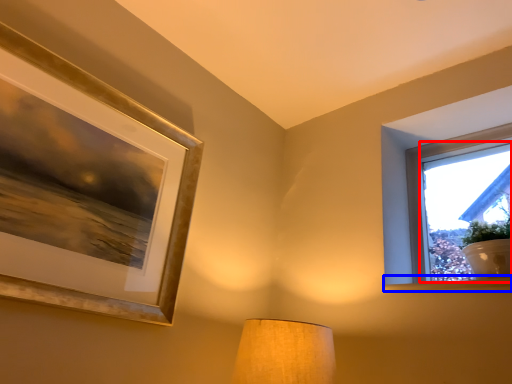
Question: Which point is closer to the camera, window screen (highlighted by a red box) or window sill (highlighted by a blue box)?

Choices:
 (A) window screen
 (B) window sill

Answer: (A)